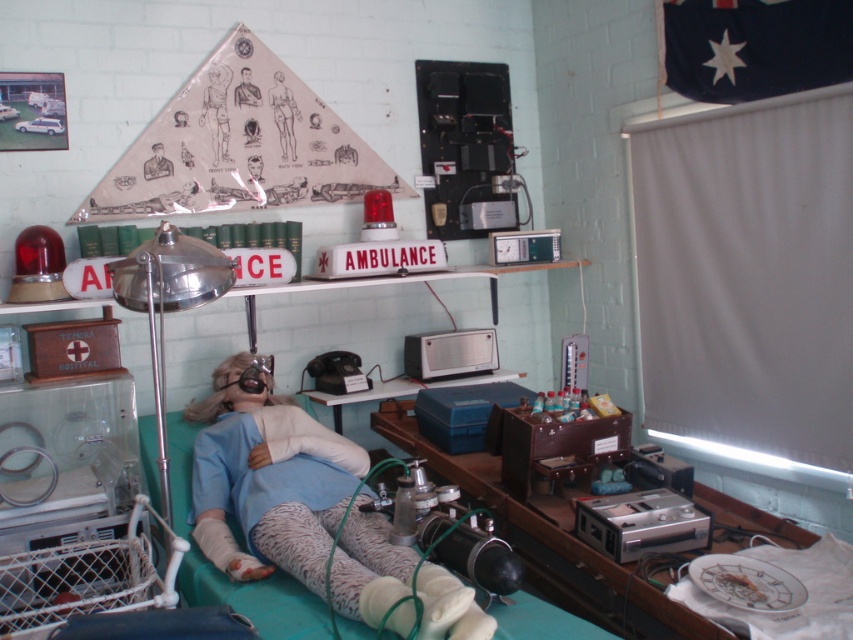
Question: Which of the following is the farthest from the observer?

Choices:
 (A) matte paper figure at center
 (B) metallic silver ambulance sign at upper center
 (C) matte plastic figure at upper center
 (D) blue fabric doll at center

Answer: (A)

Question: Does blue fabric doll at center have a larger size compared to metallic silver ambulance sign at upper center?

Choices:
 (A) no
 (B) yes

Answer: (B)

Question: Based on their relative distances, which object is farther from the blue fabric doll at center?

Choices:
 (A) matte paper figure at center
 (B) metallic silver ambulance sign at upper center

Answer: (B)

Question: Is matte paper figure at center closer to the viewer compared to metallic silver ambulance sign at upper center?

Choices:
 (A) no
 (B) yes

Answer: (A)

Question: Does blue fabric doll at center appear on the right side of metallic silver ambulance sign at upper center?

Choices:
 (A) yes
 (B) no

Answer: (A)

Question: Among these objects, which one is nearest to the camera?

Choices:
 (A) matte paper figure at center
 (B) metallic silver ambulance sign at upper center
 (C) blue fabric doll at center
 (D) matte plastic figure at upper center

Answer: (C)